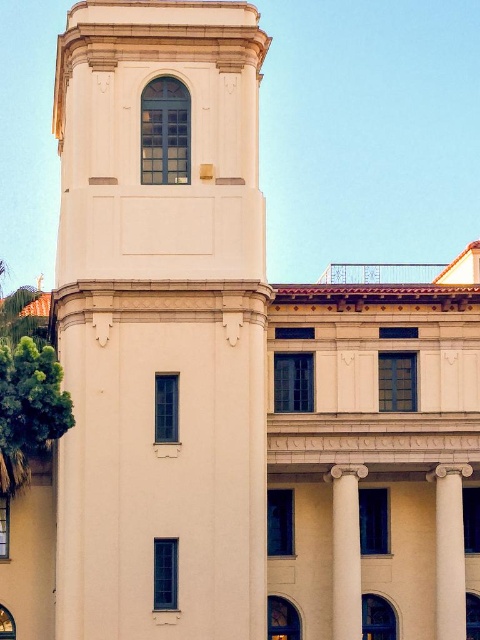
You are an architect designing a model of this building. You have two columns to place in the correct positions. Which column should be placed on the right side of the building, the white smooth column at right or the white marble column at center?

The white smooth column at right should be placed on the right side of the building because it has a larger size compared to the white marble column at center.

You are an architect examining the classical building. You notice two columns, the white smooth column at right and the white marble column at center. Which column is positioned farther to the east side of the building?

The white marble column at center is positioned farther to the east side of the building because the white smooth column at right is to the right of it, meaning the white marble column at center is located to the left, which would be the eastern direction if the building faces north.

You are an architect designing a new building inspired by classical architecture. You have to decide whether the white smooth tower at center and the white smooth column at right can be placed in a way that the column doesn not block the view of the tower from the front entrance. Based on their heights, can the column be placed in front of the tower without obscuring it?

The white smooth tower at center is much taller than the white smooth column at right. Therefore, placing the column in front of the tower would not block the view of the tower from the front entrance since the tower is significantly taller.